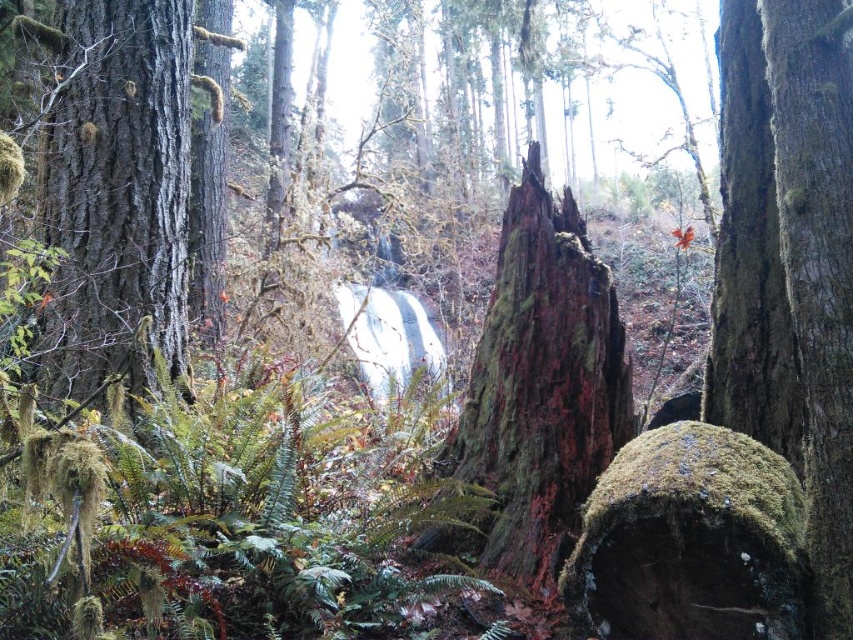
Who is more forward, (100, 96) or (724, 227)?

Positioned in front is point (724, 227).

You are a GUI agent. You are given a task and a screenshot of the screen. Output one action in this format:
    pyautogui.click(x=<x>, y=<y>)
    Task: Click on the smooth bark tree trunk at left
    The image size is (853, 640).
    Given the screenshot: What is the action you would take?
    pyautogui.click(x=119, y=195)

Find the location of `smooth bark tree trunk at left`. smooth bark tree trunk at left is located at coordinates (119, 195).

Is smooth bark tree trunk at left to the left of green mossy tree trunk at center from the viewer's perspective?

Correct, you'll find smooth bark tree trunk at left to the left of green mossy tree trunk at center.

Find the location of a particular element. smooth bark tree trunk at left is located at coordinates (119, 195).

Looking at this image, can you confirm if green mossy tree trunk at center is positioned above green mossy boulder at center?

Correct, green mossy tree trunk at center is located above green mossy boulder at center.

Can you confirm if green mossy tree trunk at center is wider than green mossy boulder at center?

Correct, the width of green mossy tree trunk at center exceeds that of green mossy boulder at center.

Where is `green mossy tree trunk at center`? Image resolution: width=853 pixels, height=640 pixels. green mossy tree trunk at center is located at coordinates (537, 394).

Find the location of a particular element. This screenshot has width=853, height=640. green mossy tree trunk at center is located at coordinates (537, 394).